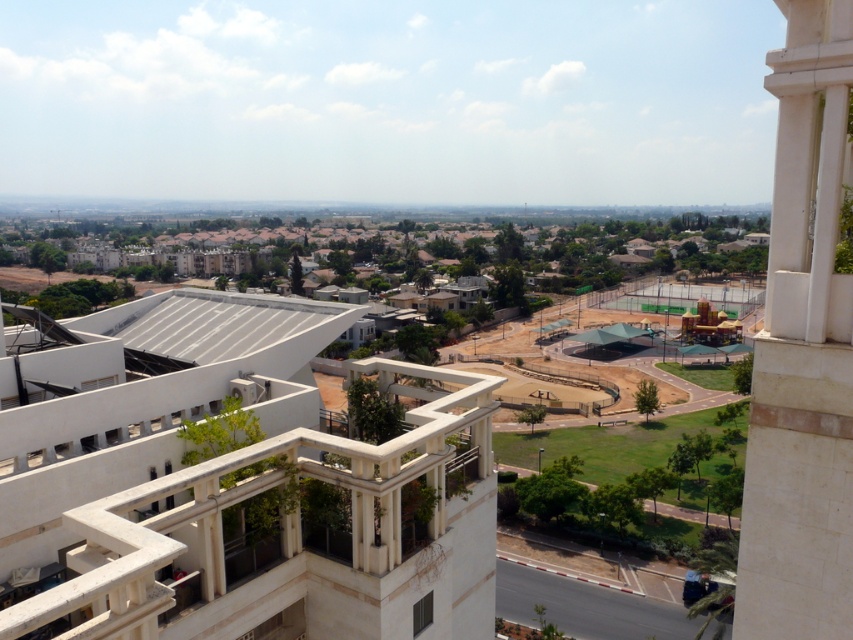
You are standing on the white concrete balcony at center and want to walk to the white stone pillar at right. Which direction should you move to reach it?

The white concrete balcony at center is positioned on the left side of white stone pillar at right, so you should move to the right to reach it.

From the picture: You are standing on the balcony of the building in the image. You notice a point marked at coordinates (297, 532). What does this point indicate?

The point at coordinates (297, 532) indicates the white concrete balcony at center.

You are a drone operator tasked with delivering a package to the white stone pillar at right. Your drone has a maximum flight range of 30 feet. Starting from the white concrete balcony at center, can your drone reach the pillar without needing a recharge?

The distance between the white concrete balcony at center and the white stone pillar at right is 39.13 feet, which exceeds the drone s 30 feet flight range. Therefore, the drone cannot reach the pillar without recharging.